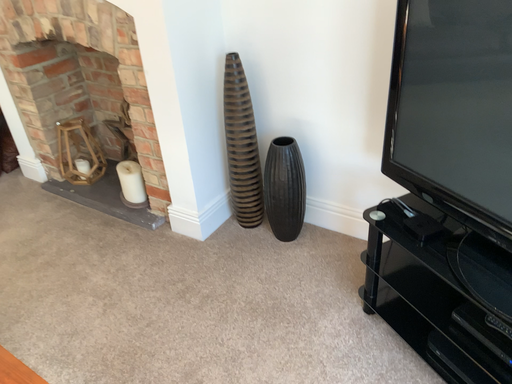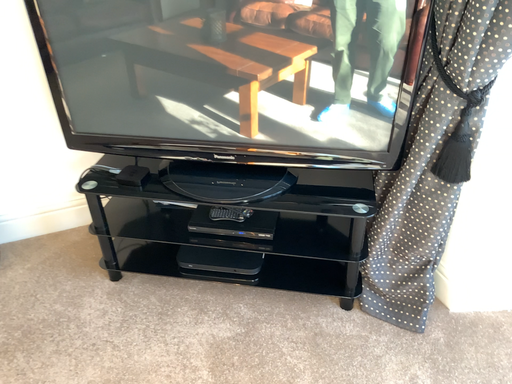
Question: Which way did the camera rotate in the video?

Choices:
 (A) rotated downward
 (B) rotated upward

Answer: (B)